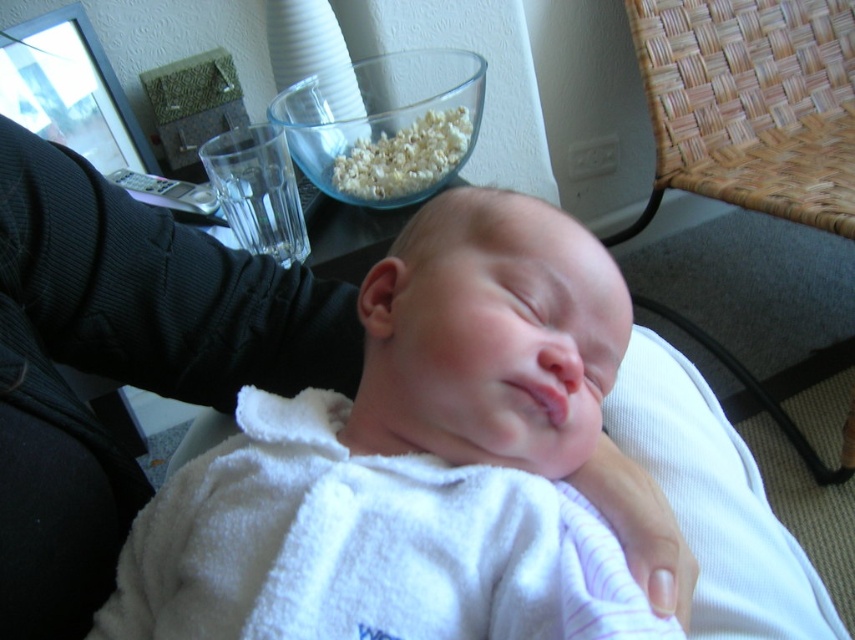
Is white soft baby at center to the right of white fluffy robe at center from the viewer's perspective?

Correct, you'll find white soft baby at center to the right of white fluffy robe at center.

Can you confirm if white soft baby at center is shorter than white fluffy robe at center?

Correct, white soft baby at center is not as tall as white fluffy robe at center.

Is point (473, 493) closer to camera compared to point (19, 168)?

Yes, it is in front of point (19, 168).

This screenshot has height=640, width=855. Identify the location of white soft baby at center. (405, 452).

Which is more to the right, white soft baby at center or transparent glass bowl at upper center?

From the viewer's perspective, white soft baby at center appears more on the right side.

Which of these two, white soft baby at center or transparent glass bowl at upper center, stands shorter?

white soft baby at center

Which is behind, point (431, 497) or point (299, 84)?

The point (299, 84) is behind.

Locate an element on the screen. This screenshot has height=640, width=855. white soft baby at center is located at coordinates (405, 452).

Is point (292, 372) in front of point (485, 70)?

Yes, it is.

Does point (327, 310) come farther from viewer compared to point (432, 182)?

No, (327, 310) is in front of (432, 182).

In order to click on white fluffy robe at center in this screenshot , I will do `click(121, 362)`.